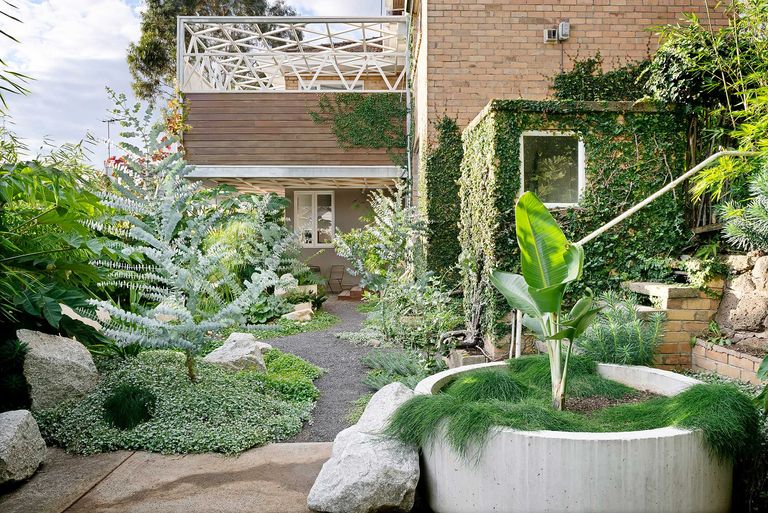
Locate an element on the screen. window is located at coordinates (565, 190), (323, 216).